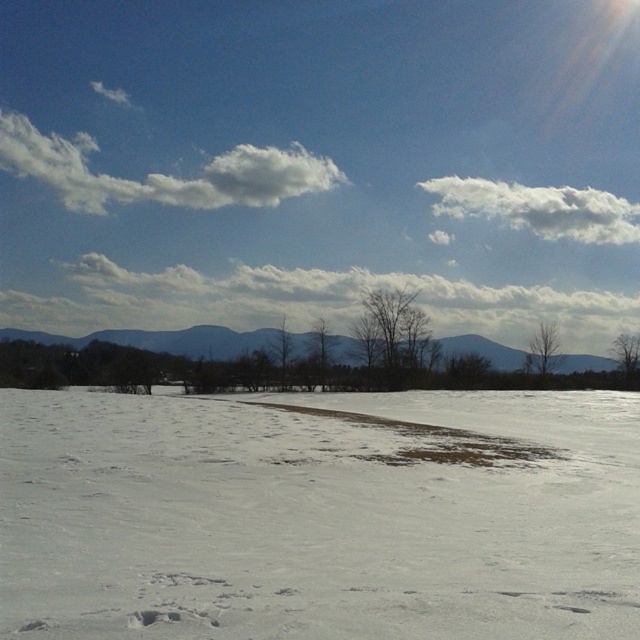
Question: Which of the following is the farthest from the observer?

Choices:
 (A) white fluffy cloud at upper center
 (B) gray matte mountain at center
 (C) white fluffy cloud at upper left
 (D) white powdery snow at center

Answer: (A)

Question: Is white fluffy cloud at upper center wider than gray matte mountain at center?

Choices:
 (A) yes
 (B) no

Answer: (B)

Question: Considering the relative positions of white fluffy cloud at upper left and white fluffy cloud at upper center in the image provided, where is white fluffy cloud at upper left located with respect to white fluffy cloud at upper center?

Choices:
 (A) above
 (B) below

Answer: (A)

Question: Which is farther from the white powdery snow at center?

Choices:
 (A) gray matte mountain at center
 (B) white fluffy cloud at upper left

Answer: (B)

Question: Does white fluffy cloud at upper left appear under white fluffy cloud at upper center?

Choices:
 (A) no
 (B) yes

Answer: (A)

Question: Which point appears closest to the camera in this image?

Choices:
 (A) (483, 339)
 (B) (294, 188)
 (C) (602, 202)
 (D) (332, 448)

Answer: (D)